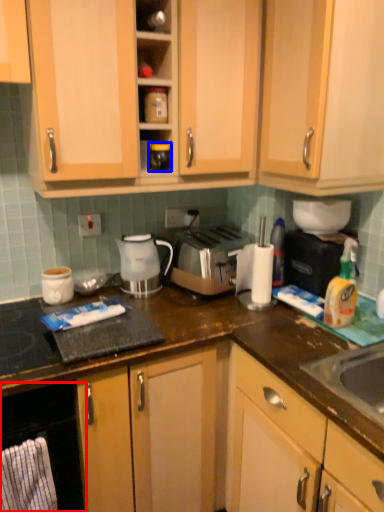
Question: Which point is further to the camera, oven (highlighted by a red box) or appliance (highlighted by a blue box)?

Choices:
 (A) oven
 (B) appliance

Answer: (B)